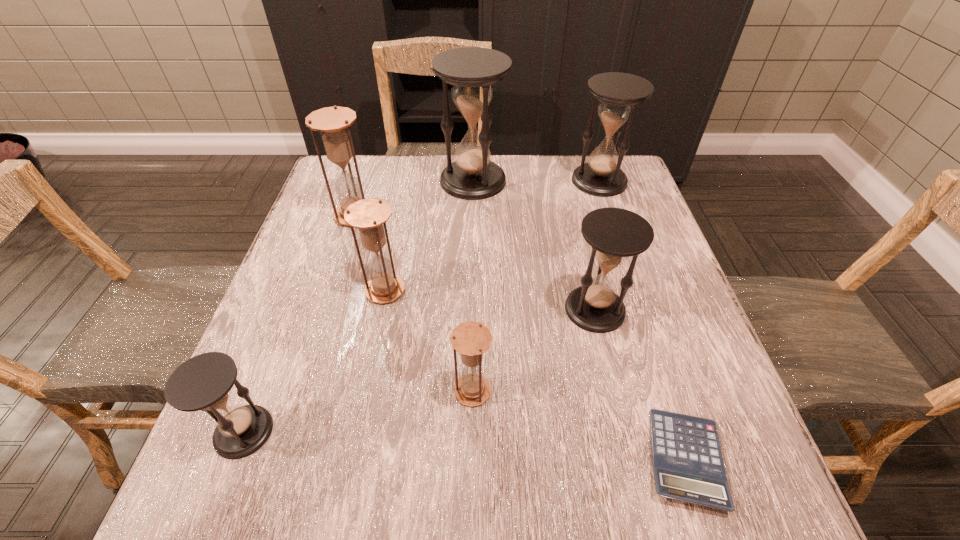
Where is `vacant space that satisfies the following two spatial constraints: 1. on the back side of the farthest brown hourglass; 2. on the left side of the smallest black hourglass`? The width and height of the screenshot is (960, 540). vacant space that satisfies the following two spatial constraints: 1. on the back side of the farthest brown hourglass; 2. on the left side of the smallest black hourglass is located at coordinates (327, 215).